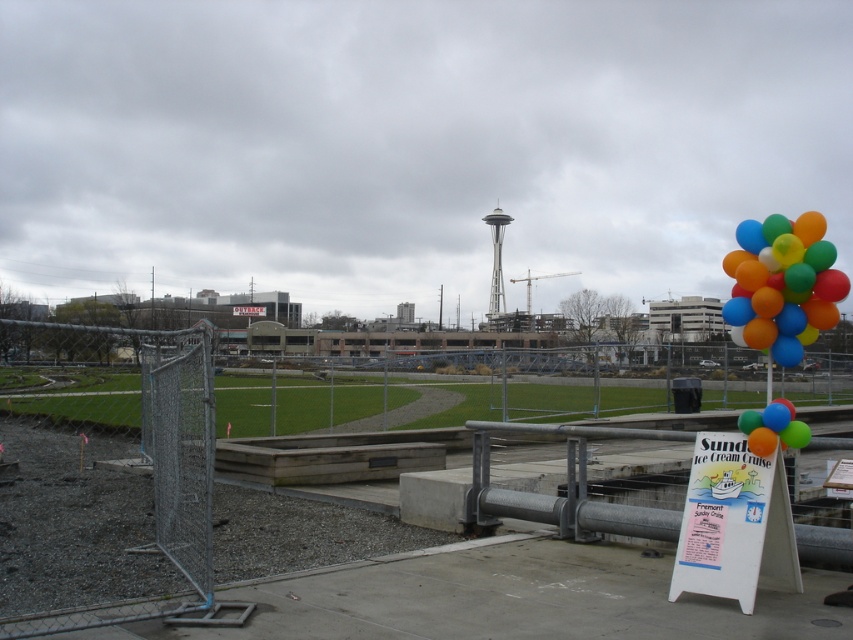
This screenshot has width=853, height=640. In order to click on metallic chain-link fence at lower left in this screenshot , I will do `click(148, 385)`.

Is point (616, 419) closer to viewer compared to point (825, 278)?

No, (616, 419) is further to viewer.

This screenshot has height=640, width=853. What are the coordinates of `metallic chain-link fence at lower left` in the screenshot? It's located at (148, 385).

Can you confirm if smooth concrete platform at center is taller than metallic chain-link fence at lower left?

No, smooth concrete platform at center is not taller than metallic chain-link fence at lower left.

Which of these two, smooth concrete platform at center or metallic chain-link fence at lower left, stands taller?

With more height is metallic chain-link fence at lower left.

Is point (71, 547) farther from viewer compared to point (47, 396)?

No, (71, 547) is in front of (47, 396).

Locate an element on the screen. The image size is (853, 640). smooth concrete platform at center is located at coordinates [146, 486].

Which is below, white cardboard sign at lower right or multicolored glossy balloons at right?

white cardboard sign at lower right is lower down.

Is point (674, 600) positioned before point (776, 296)?

No, it is behind (776, 296).

In order to click on white cardboard sign at lower right in this screenshot , I will do `click(734, 522)`.